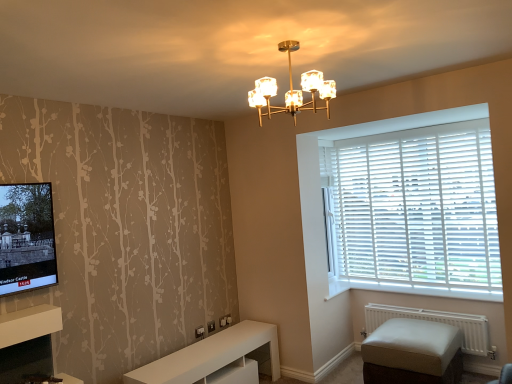
Question: Should I look upward or downward to see white matte radiator at lower right?

Choices:
 (A) up
 (B) down

Answer: (B)

Question: Considering the relative sizes of white matte shelf at lower left and white wood blinds at right in the image provided, is white matte shelf at lower left thinner than white wood blinds at right?

Choices:
 (A) yes
 (B) no

Answer: (B)

Question: Are white matte shelf at lower left and white wood blinds at right located far from each other?

Choices:
 (A) no
 (B) yes

Answer: (B)

Question: Considering the relative sizes of white matte shelf at lower left and white wood blinds at right in the image provided, is white matte shelf at lower left smaller than white wood blinds at right?

Choices:
 (A) no
 (B) yes

Answer: (B)

Question: From the image's perspective, would you say white matte shelf at lower left is positioned over white wood blinds at right?

Choices:
 (A) no
 (B) yes

Answer: (A)

Question: Is white matte shelf at lower left aimed at white wood blinds at right?

Choices:
 (A) yes
 (B) no

Answer: (B)

Question: Is white matte shelf at lower left at the left side of white wood blinds at right?

Choices:
 (A) no
 (B) yes

Answer: (B)

Question: Is white matte radiator at lower right bigger than gold metallic chandelier at upper center?

Choices:
 (A) yes
 (B) no

Answer: (B)

Question: From the image's perspective, is white matte radiator at lower right located above gold metallic chandelier at upper center?

Choices:
 (A) yes
 (B) no

Answer: (B)

Question: Could you tell me if white matte radiator at lower right is turned towards gold metallic chandelier at upper center?

Choices:
 (A) yes
 (B) no

Answer: (B)

Question: From the image's perspective, is white matte radiator at lower right beneath gold metallic chandelier at upper center?

Choices:
 (A) yes
 (B) no

Answer: (A)

Question: Is white matte radiator at lower right further to camera compared to gold metallic chandelier at upper center?

Choices:
 (A) yes
 (B) no

Answer: (A)

Question: Is white matte radiator at lower right taller than gold metallic chandelier at upper center?

Choices:
 (A) no
 (B) yes

Answer: (A)

Question: Would you consider beige fabric ottoman at lower right to be distant from gold metallic chandelier at upper center?

Choices:
 (A) yes
 (B) no

Answer: (A)